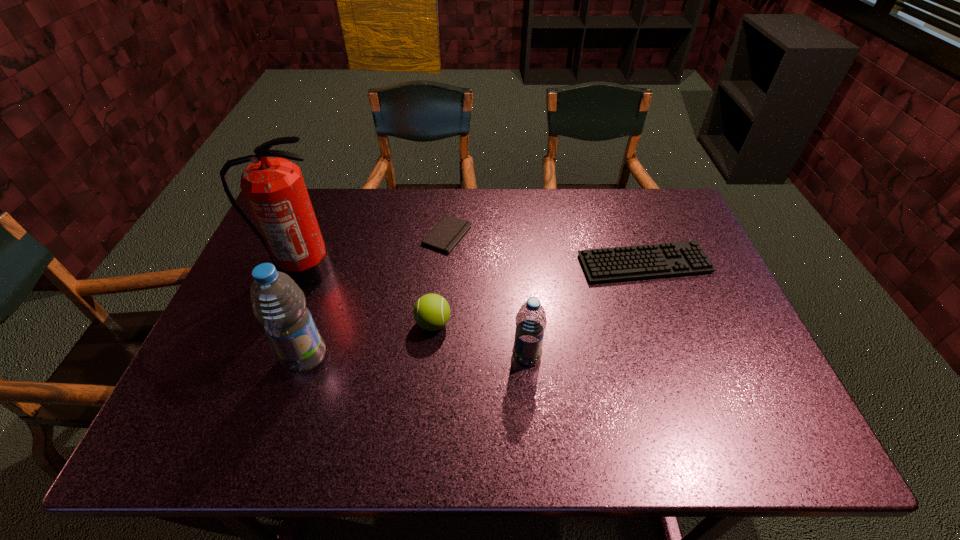
This screenshot has width=960, height=540. In order to click on vacant space at the far edge of the desktop in this screenshot , I will do `click(503, 192)`.

Identify the location of vacant area at the right edge of the desktop. The image size is (960, 540). (725, 294).

In the image, there is a desktop. At what (x,y) coordinates should I click in order to perform the action: click on vacant space at the far right corner. Please return your answer as a coordinate pair (x, y). Looking at the image, I should click on (644, 205).

Image resolution: width=960 pixels, height=540 pixels. What are the coordinates of `free point at the near right corner` in the screenshot? It's located at (754, 385).

At what (x,y) coordinates should I click in order to perform the action: click on vacant space that's between the taller water bottle and the right water bottle. Please return your answer as a coordinate pair (x, y). Looking at the image, I should click on (416, 356).

The image size is (960, 540). What are the coordinates of `free point between the second object from right to left and the checkbook` in the screenshot? It's located at (487, 295).

Identify the location of free point between the tennis ball and the tallest object. (368, 297).

This screenshot has height=540, width=960. I want to click on free spot between the second object from right to left and the checkbook, so pos(487,295).

The image size is (960, 540). What are the coordinates of `free space between the tallest object and the tennis ball` in the screenshot? It's located at (368, 297).

The height and width of the screenshot is (540, 960). Identify the location of free space between the shortest object and the second object from right to left. (487, 295).